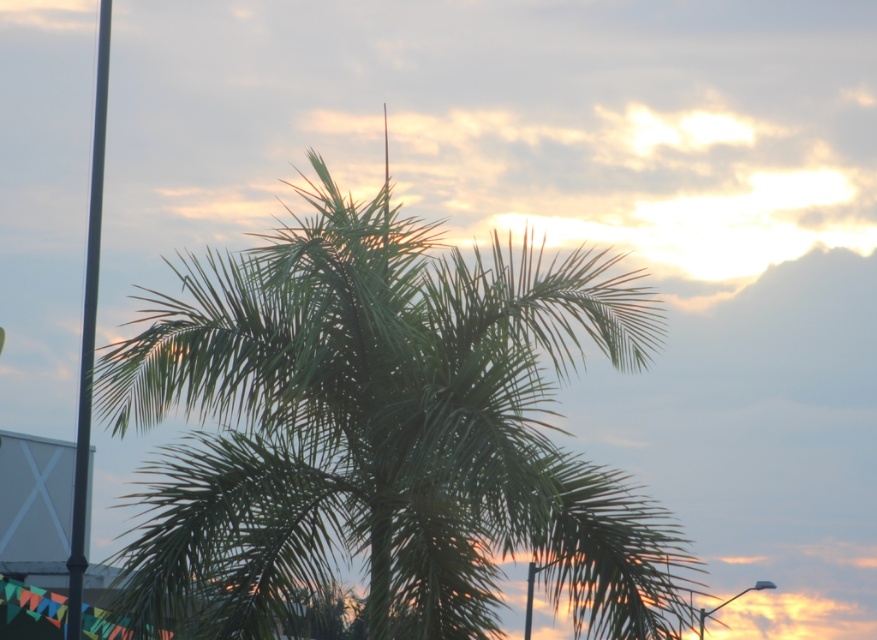
Between point (433, 374) and point (82, 580), which one is positioned behind?

Point (82, 580)

What do you see at coordinates (382, 433) in the screenshot? The image size is (877, 640). I see `green leafy palm tree at center` at bounding box center [382, 433].

Between point (355, 424) and point (87, 408), which one is positioned behind?

The point (87, 408) is behind.

At what (x,y) coordinates should I click in order to perform the action: click on green leafy palm tree at center. Please return your answer as a coordinate pair (x, y). The image size is (877, 640). Looking at the image, I should click on (382, 433).